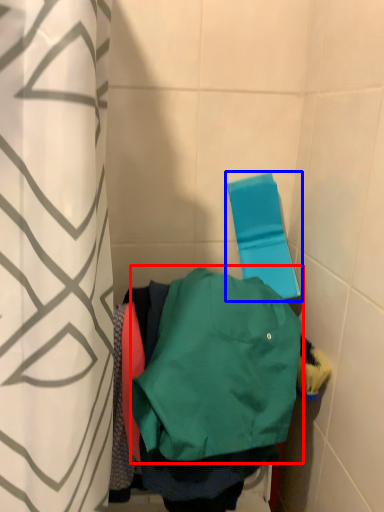
Question: Among these objects, which one is farthest to the camera, sweatshirt (highlighted by a red box) or beach towel (highlighted by a blue box)?

Choices:
 (A) sweatshirt
 (B) beach towel

Answer: (B)